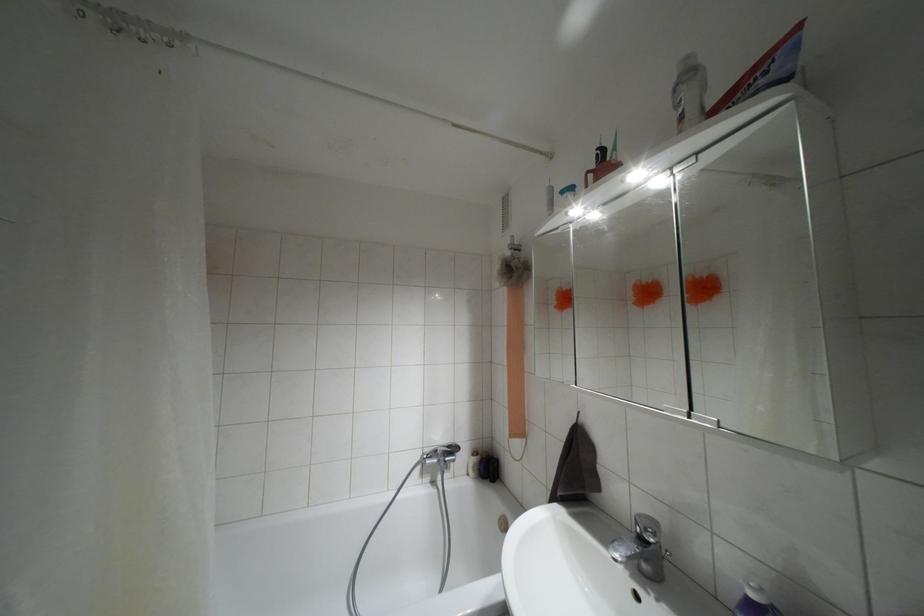
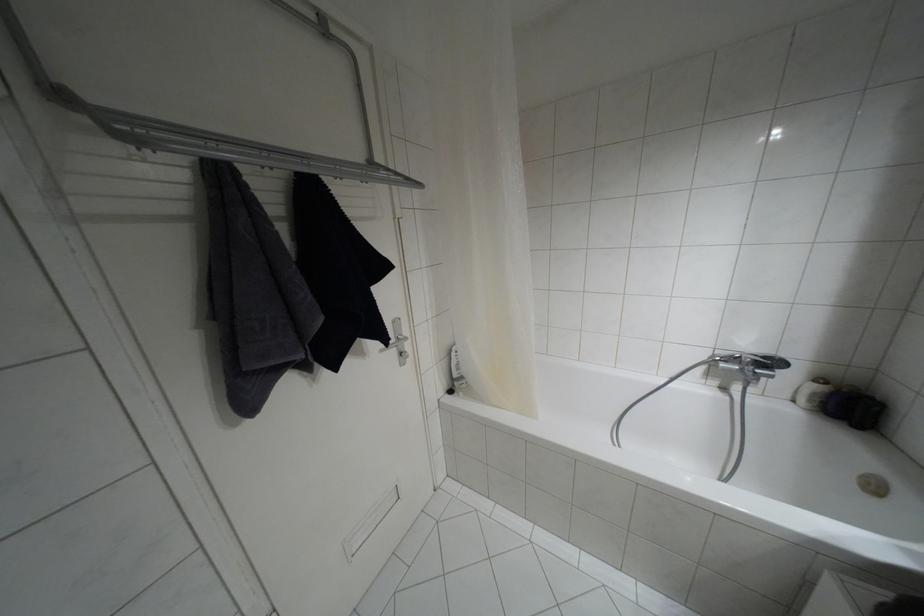
Find the pixel in the second image that matches pixel 475 452 in the first image.

(820, 379)